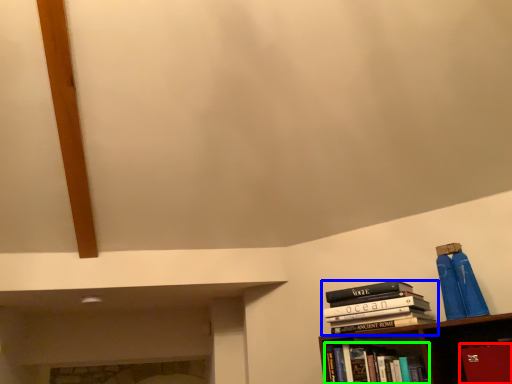
Question: Considering the real-world distances, which object is closest to paperback book (highlighted by a red box)? book (highlighted by a blue box) or book (highlighted by a green box).

Choices:
 (A) book
 (B) book

Answer: (A)